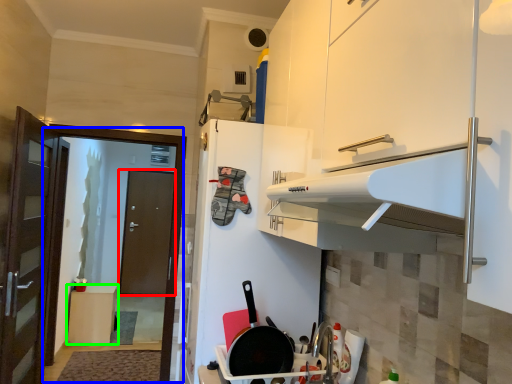
Question: Considering the real-world distances, which object is farthest from door (highlighted by a red box)? screen door (highlighted by a blue box) or furniture (highlighted by a green box)?

Choices:
 (A) screen door
 (B) furniture

Answer: (A)